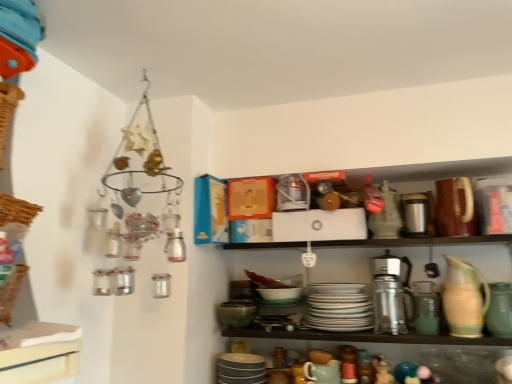
Question: Can you confirm if white glossy plates at center, which is counted as the 3th tableware, starting from the right, is taller than matte ceramic mug at lower center, positioned as the second tableware in left-to-right order?

Choices:
 (A) yes
 (B) no

Answer: (A)

Question: Is white glossy plates at center, which is counted as the 3th tableware, starting from the right, smaller than matte ceramic mug at lower center, positioned as the second tableware in left-to-right order?

Choices:
 (A) yes
 (B) no

Answer: (B)

Question: Is matte ceramic mug at lower center, positioned as the second tableware in left-to-right order, a part of white glossy plates at center, which is counted as the 3th tableware, starting from the right?

Choices:
 (A) no
 (B) yes

Answer: (A)

Question: From a real-world perspective, is white glossy plates at center, which is counted as the 3th tableware, starting from the right, over matte ceramic mug at lower center, the fourth tableware when ordered from right to left?

Choices:
 (A) no
 (B) yes

Answer: (B)

Question: Is white glossy plates at center, which is counted as the 3th tableware, starting from the right, not close to matte ceramic mug at lower center, the fourth tableware when ordered from right to left?

Choices:
 (A) yes
 (B) no

Answer: (B)

Question: Is white glossy plates at center, the third tableware positioned from the left, in front of matte ceramic mug at lower center, positioned as the second tableware in left-to-right order?

Choices:
 (A) no
 (B) yes

Answer: (A)

Question: Does matte gray plates at lower center, the 5th tableware from the right, have a smaller size compared to white glossy plates at center, which is counted as the 3th tableware, starting from the right?

Choices:
 (A) yes
 (B) no

Answer: (A)

Question: Is matte gray plates at lower center, the first tableware from the left, far from white glossy plates at center, the third tableware positioned from the left?

Choices:
 (A) no
 (B) yes

Answer: (A)

Question: Does matte gray plates at lower center, the first tableware from the left, turn towards white glossy plates at center, which is counted as the 3th tableware, starting from the right?

Choices:
 (A) yes
 (B) no

Answer: (B)

Question: Does matte gray plates at lower center, the first tableware from the left, have a greater width compared to white glossy plates at center, which is counted as the 3th tableware, starting from the right?

Choices:
 (A) no
 (B) yes

Answer: (A)

Question: Considering the relative positions of matte gray plates at lower center, the 5th tableware from the right, and white glossy plates at center, which is counted as the 3th tableware, starting from the right, in the image provided, is matte gray plates at lower center, the 5th tableware from the right, to the right of white glossy plates at center, which is counted as the 3th tableware, starting from the right, from the viewer's perspective?

Choices:
 (A) no
 (B) yes

Answer: (A)

Question: Can you confirm if matte gray plates at lower center, the first tableware from the left, is positioned to the left of white glossy plates at center, which is counted as the 3th tableware, starting from the right?

Choices:
 (A) no
 (B) yes

Answer: (B)

Question: Does metallic silver thermos at lower right appear on the right side of woven brown basket at left?

Choices:
 (A) yes
 (B) no

Answer: (A)